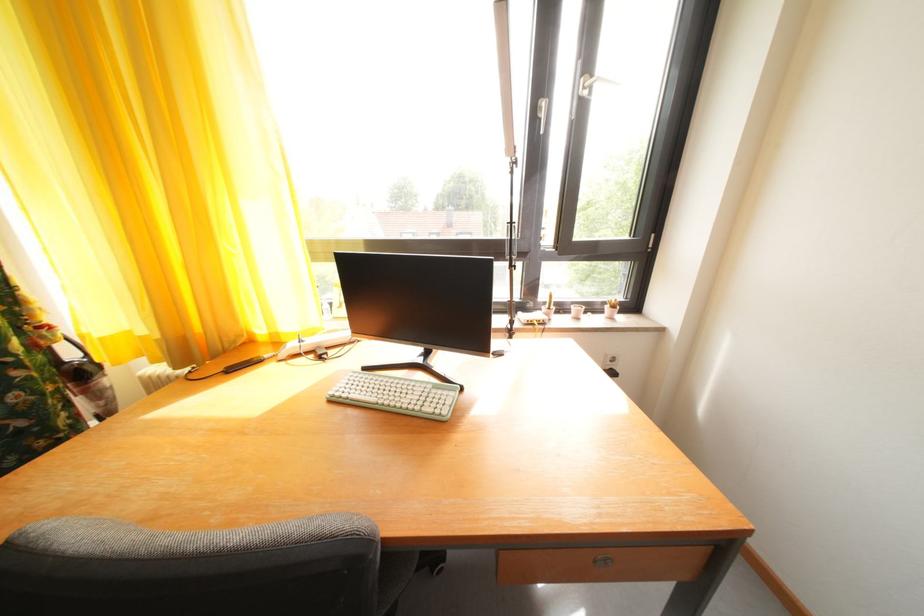
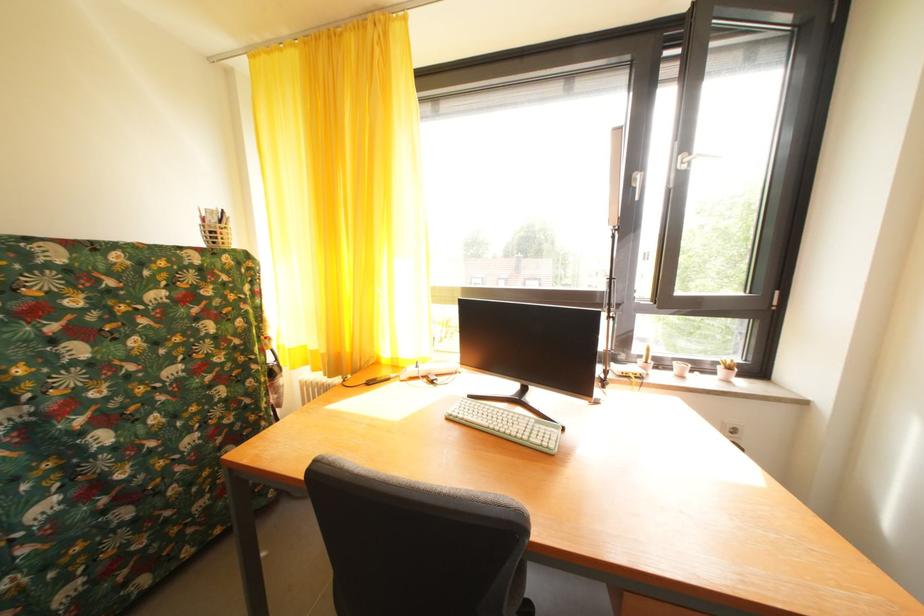
Locate, in the second image, the point that corresponds to [616,313] in the first image.

(728, 374)